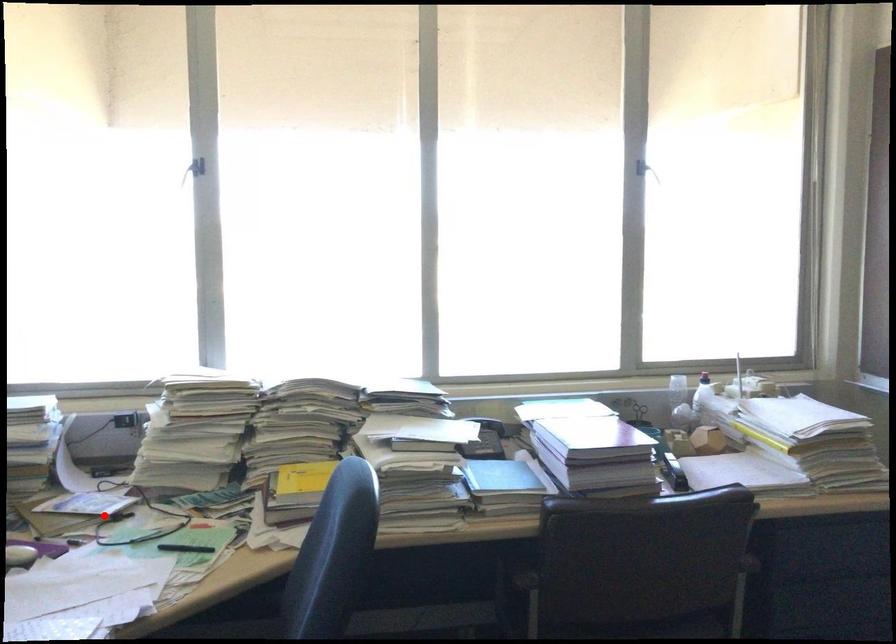
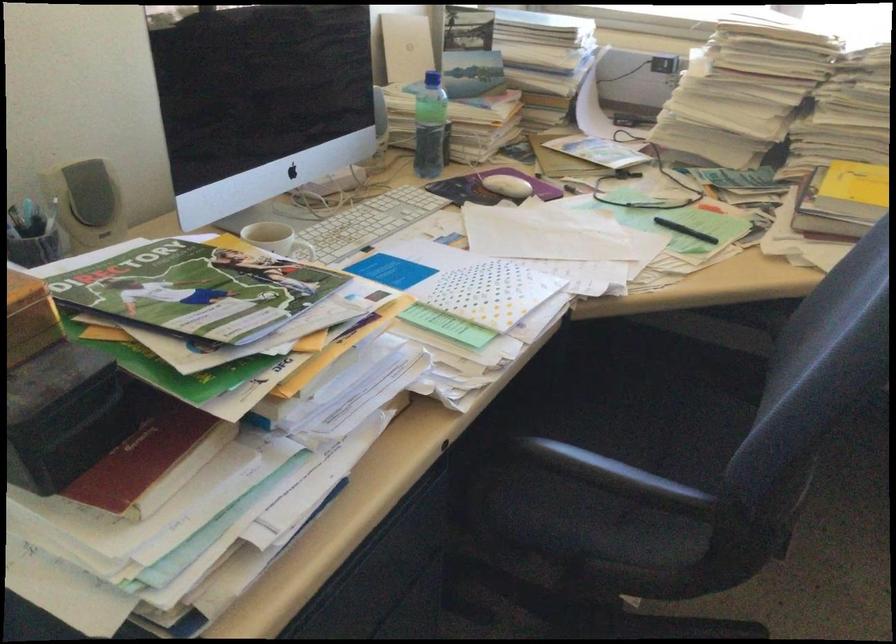
Find the pixel in the second image that matches the highlighted location in the first image.

(610, 166)